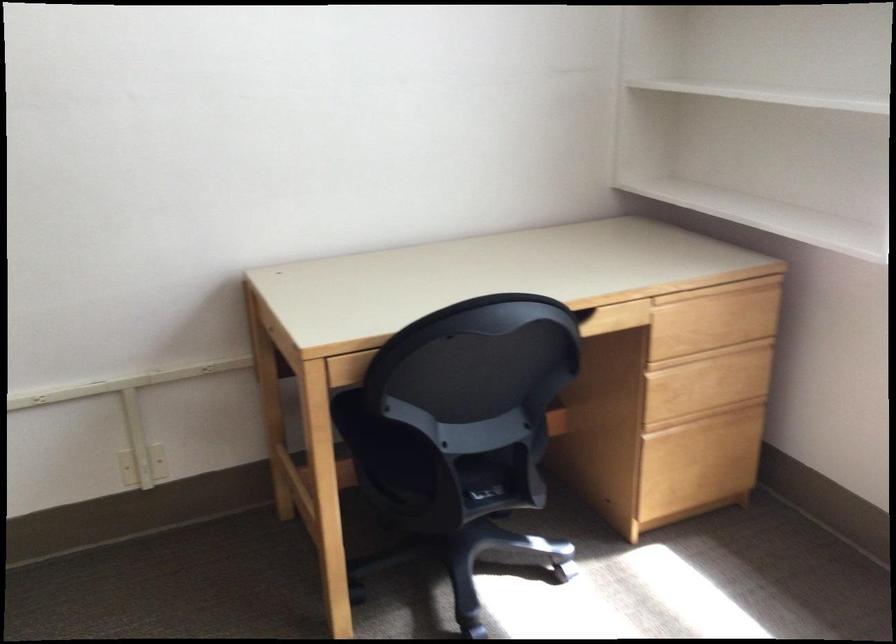
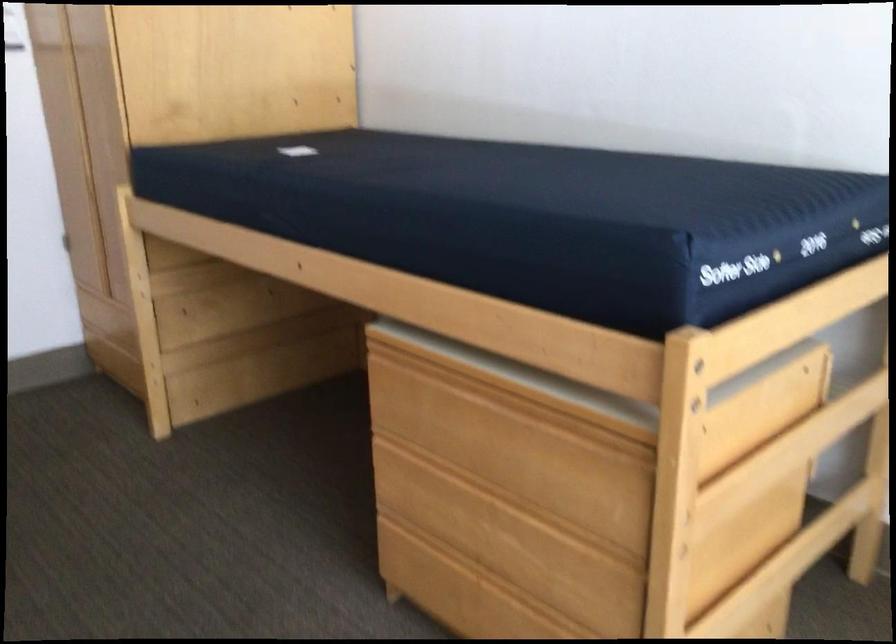
Question: The camera is either moving clockwise (left) or counter-clockwise (right) around the object. The first image is from the beginning of the video and the second image is from the end. Is the camera moving left or right when shooting the video?

Choices:
 (A) Left
 (B) Right

Answer: (B)